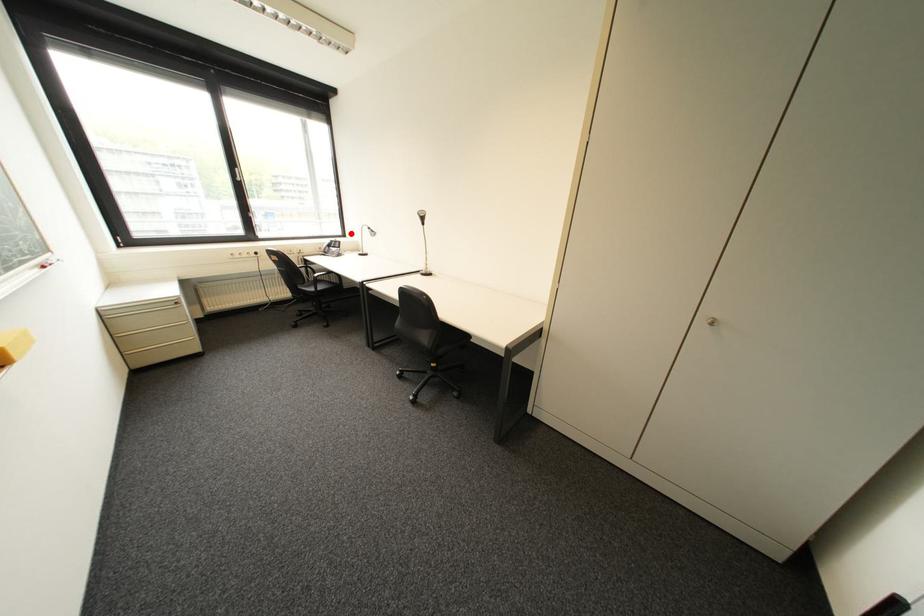
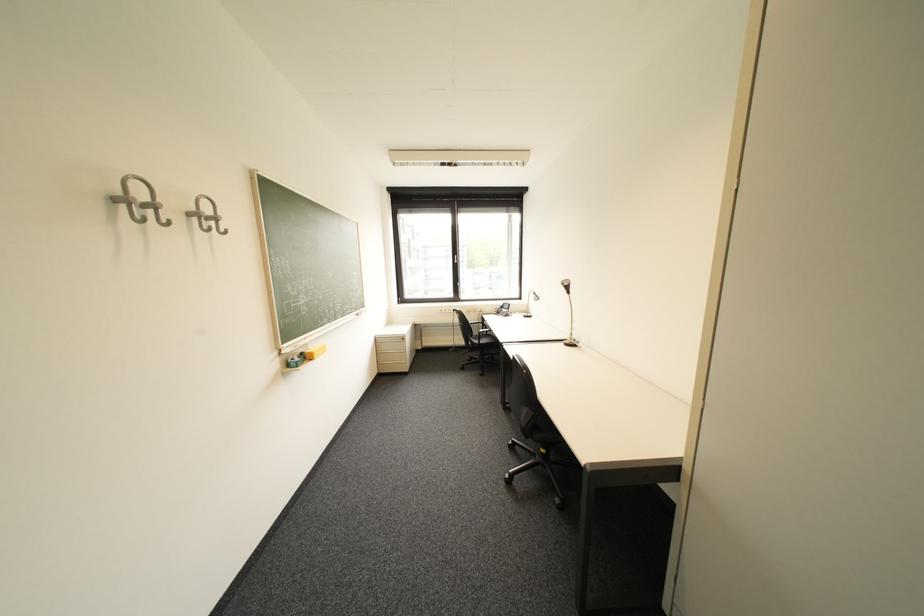
Where in the second image is the point corresponding to the highlighted location from the first image?

(528, 297)